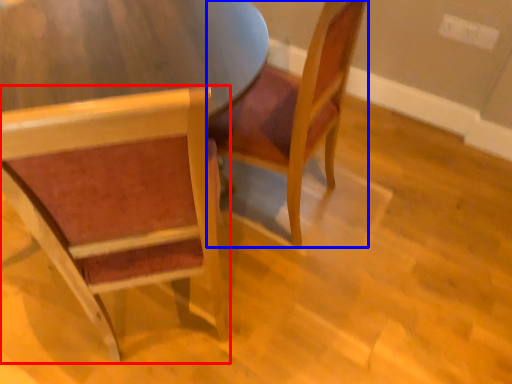
Question: Which object appears farthest to the camera in this image, chair (highlighted by a red box) or chair (highlighted by a blue box)?

Choices:
 (A) chair
 (B) chair

Answer: (B)